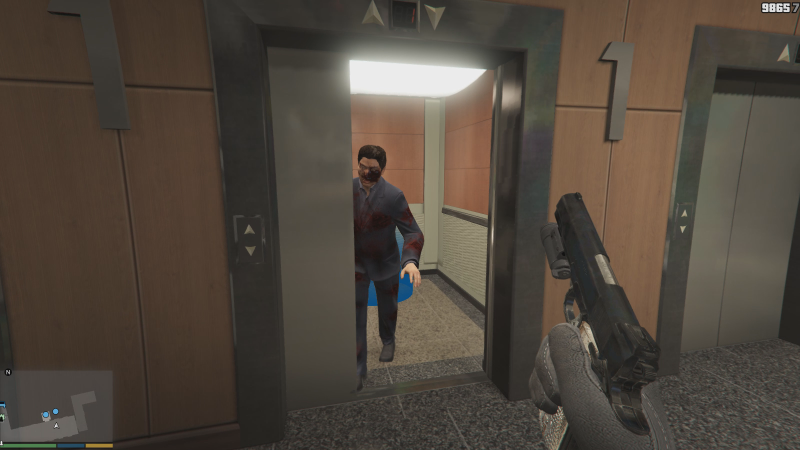
I want to click on wall, so click(x=170, y=203).